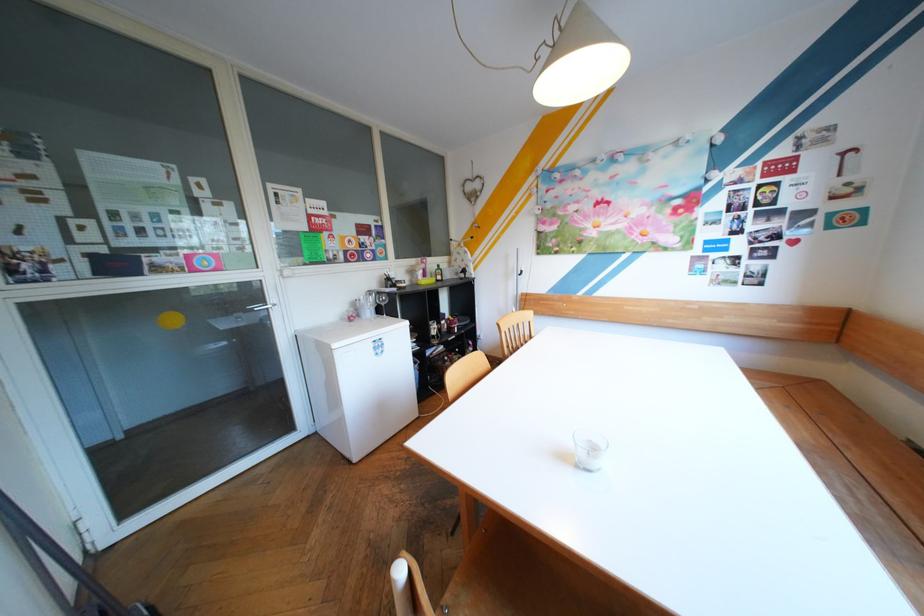
Find the location of a particular element. The image size is (924, 616). sofa sitting surface is located at coordinates (849, 429).